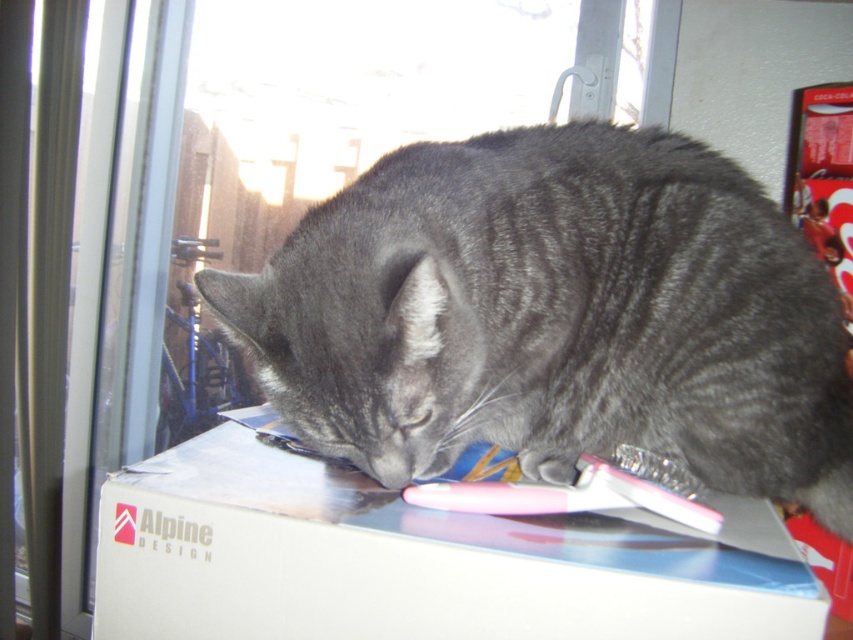
Is white cardboard box at center positioned before gray fur paw at lower center?

Yes, it is in front of gray fur paw at lower center.

Can you confirm if white cardboard box at center is wider than gray fur paw at lower center?

Yes.

Which is behind, point (740, 604) or point (527, 474)?

Point (527, 474)

Identify the location of white cardboard box at center. (418, 561).

From the picture: Measure the distance from gray fur cat at center to white cardboard box at center.

They are 7.10 inches apart.

Is gray fur cat at center above white cardboard box at center?

Correct, gray fur cat at center is located above white cardboard box at center.

Locate an element on the screen. This screenshot has height=640, width=853. gray fur cat at center is located at coordinates (556, 314).

This screenshot has width=853, height=640. I want to click on gray fur cat at center, so click(556, 314).

Does gray fur cat at center have a greater width compared to gray fur paw at lower center?

Correct, the width of gray fur cat at center exceeds that of gray fur paw at lower center.

In the scene shown: Is gray fur cat at center smaller than gray fur paw at lower center?

No, gray fur cat at center is not smaller than gray fur paw at lower center.

Identify the location of gray fur cat at center. This screenshot has height=640, width=853. (556, 314).

The width and height of the screenshot is (853, 640). In order to click on gray fur cat at center in this screenshot , I will do `click(556, 314)`.